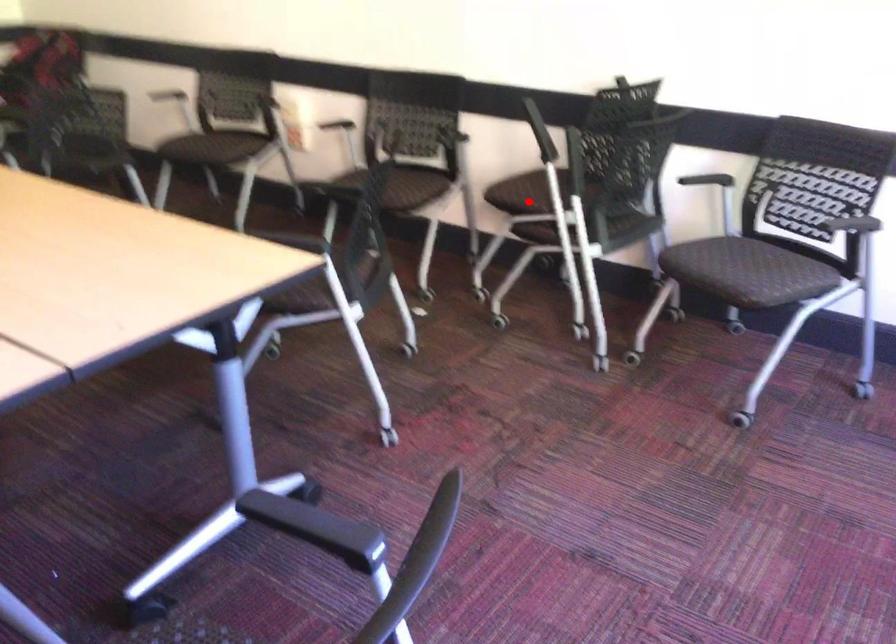
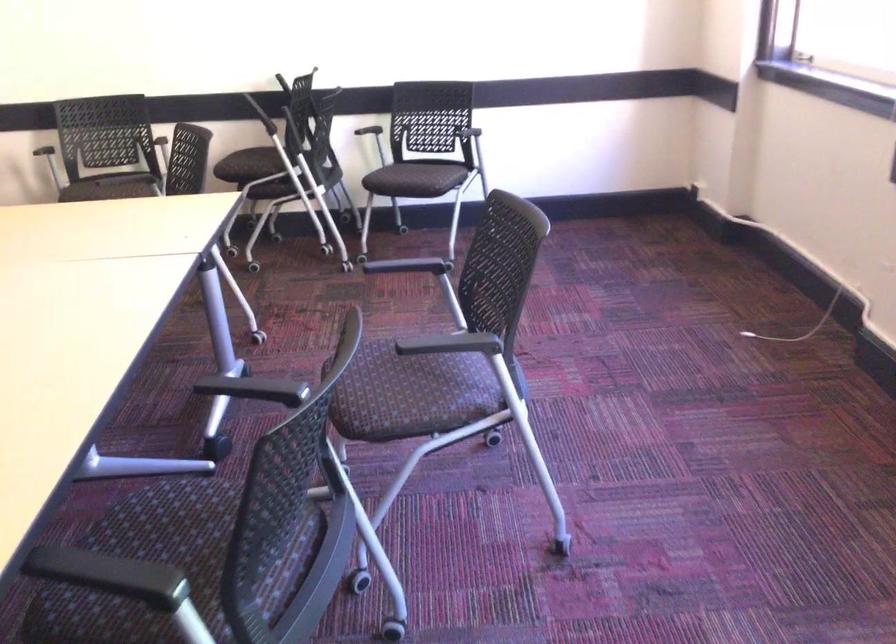
Question: A red point is marked in image1. In image2, is the corresponding 3D point closer to the camera or farther? Reply with the corresponding letter.

Choices:
 (A) The corresponding 3D point is closer.
 (B) The corresponding 3D point is farther.

Answer: (B)